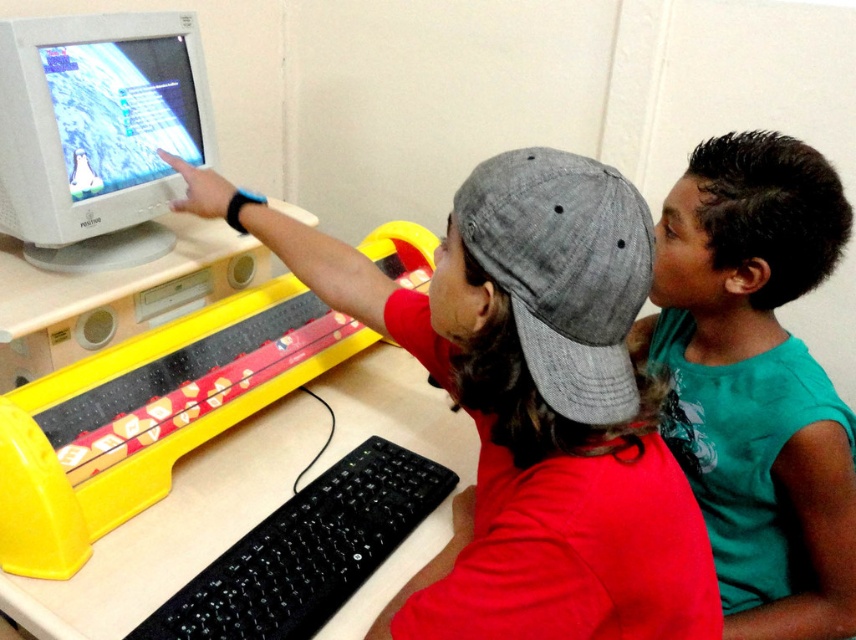
Is point (638, 339) positioned before point (129, 388)?

No.

Between green matte shirt at right and yellow plastic video game at left, which one is positioned lower?

green matte shirt at right

What are the coordinates of `green matte shirt at right` in the screenshot? It's located at (758, 380).

Is green matte shirt at right to the left of white glossy computer monitor at upper left from the viewer's perspective?

In fact, green matte shirt at right is to the right of white glossy computer monitor at upper left.

Is point (736, 538) farther from viewer compared to point (140, 132)?

No, it is in front of (140, 132).

Is point (829, 433) in front of point (192, 52)?

Yes, point (829, 433) is in front of point (192, 52).

In order to click on green matte shirt at right in this screenshot , I will do `click(758, 380)`.

Does point (198, 61) come farther from viewer compared to point (141, 624)?

Yes, point (198, 61) is behind point (141, 624).

Can you confirm if white glossy computer monitor at upper left is positioned to the right of black plastic keyboard at lower center?

No, white glossy computer monitor at upper left is not to the right of black plastic keyboard at lower center.

Image resolution: width=856 pixels, height=640 pixels. What are the coordinates of `white glossy computer monitor at upper left` in the screenshot? It's located at (97, 132).

The height and width of the screenshot is (640, 856). I want to click on white glossy computer monitor at upper left, so click(97, 132).